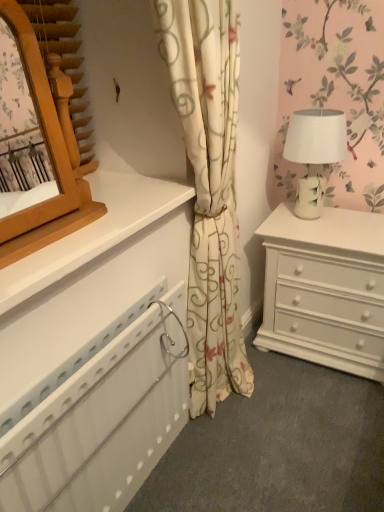
This screenshot has height=512, width=384. In order to click on vacant space underneath white ceramic table lamp at right (from a real-world perspective) in this screenshot , I will do `click(322, 218)`.